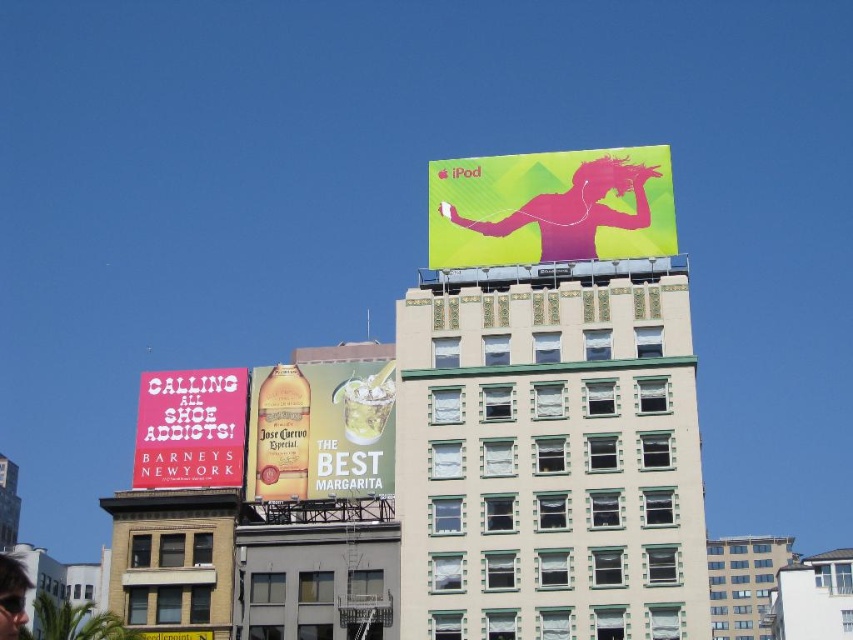
You are a graphic designer working on a new ad campaign. You need to place a new ad for a tech gadget between the existing Apple iPod billboard at upper right and the Barneys New York shoe ad below it. The new ad must be placed at point (550,208). What object is already at this location?

The point (550,208) is marked as the location of the pink matte iPod at upper center. Therefore, the pink matte iPod at upper center is already present at that coordinate.